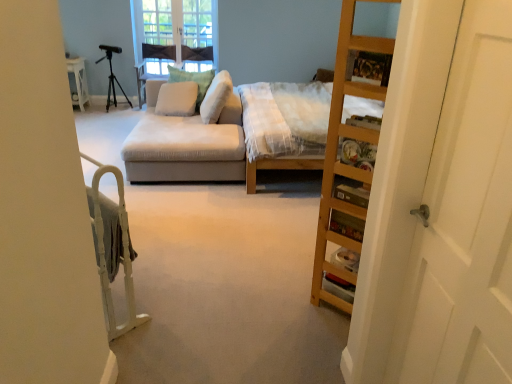
The image size is (512, 384). Identify the location of vacant space to the left of wooden bookshelf at right. (281, 290).